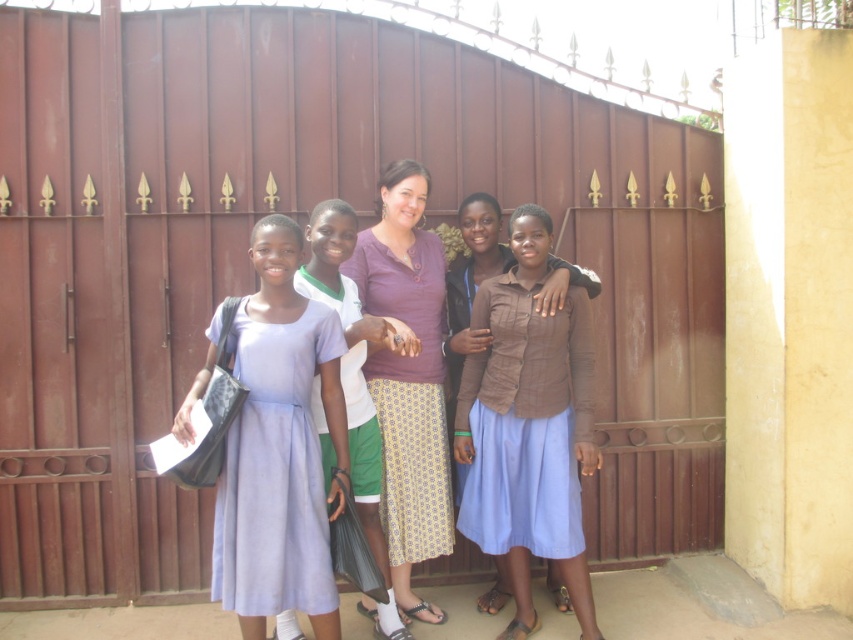
Question: Among these points, which one is farthest from the camera?

Choices:
 (A) (305, 330)
 (B) (514, 305)
 (C) (323, 458)

Answer: (B)

Question: Which of the following is the closest to the observer?

Choices:
 (A) (383, 364)
 (B) (276, 385)
 (C) (567, 552)
 (D) (407, 636)

Answer: (B)

Question: Which of the following is the farthest from the observer?

Choices:
 (A) brown textured shirt at center
 (B) purple textured shirt at center
 (C) lavender satin dress at center
 (D) purple cotton shirt at center

Answer: (D)

Question: Where is lavender satin dress at center located in relation to purple textured shirt at center in the image?

Choices:
 (A) above
 (B) below

Answer: (B)

Question: From the image, what is the correct spatial relationship of purple cotton shirt at center in relation to purple textured shirt at center?

Choices:
 (A) above
 (B) below

Answer: (A)

Question: Is lavender satin dress at center positioned behind purple textured shirt at center?

Choices:
 (A) no
 (B) yes

Answer: (A)